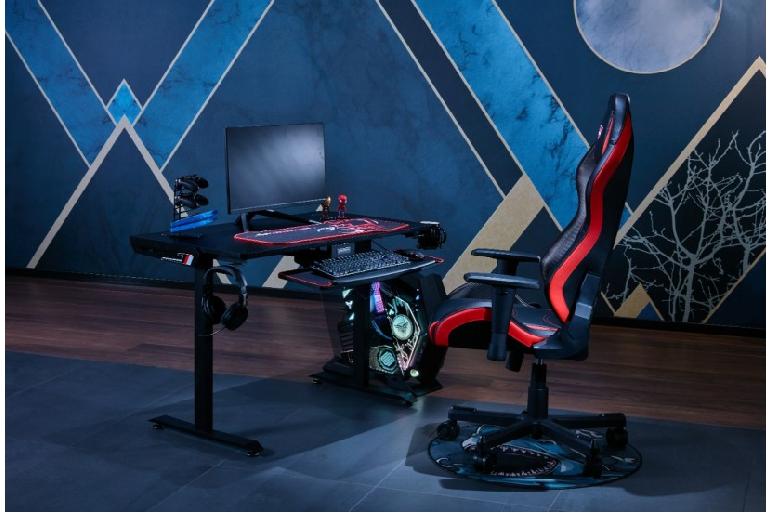
At what (x,y) coordinates should I click in order to perform the action: click on blue area of the wall in the background. Please return your answer as a coordinate pair (x, y). This screenshot has width=768, height=512. Looking at the image, I should click on (391, 131).